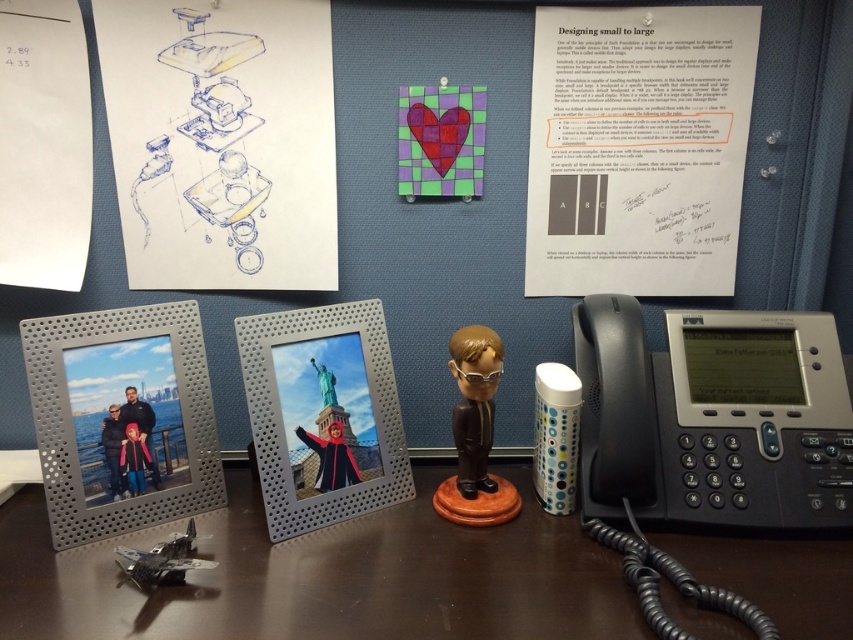
Question: Which object is farther from the camera taking this photo?

Choices:
 (A) shiny brown bobblehead at center
 (B) brown wooden table at lower center
 (C) blue ink drawing at upper left

Answer: (C)

Question: Which of the following is the farthest from the observer?

Choices:
 (A) blue ink drawing at upper left
 (B) metallic silver miniature at lower left
 (C) white paper at upper right

Answer: (C)

Question: Does white paper at upper right come behind shiny brown bobblehead at center?

Choices:
 (A) yes
 (B) no

Answer: (A)

Question: Is blue ink drawing at upper left thinner than metallic silver miniature at lower left?

Choices:
 (A) no
 (B) yes

Answer: (A)

Question: Does blue ink drawing at upper left have a larger size compared to shiny brown bobblehead at center?

Choices:
 (A) yes
 (B) no

Answer: (A)

Question: Among these objects, which one is farthest from the camera?

Choices:
 (A) blue ink drawing at upper left
 (B) white paper at upper right
 (C) metallic silver miniature at lower left

Answer: (B)